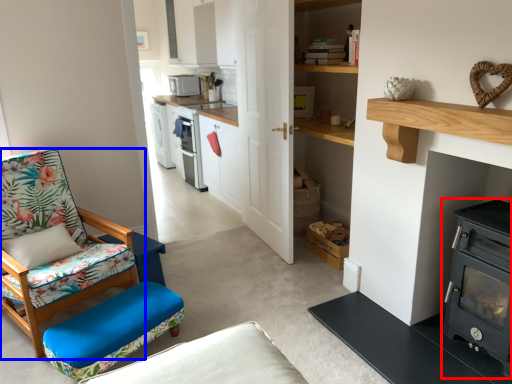
Question: Among these objects, which one is farthest to the camera, wood burning stove (highlighted by a red box) or chair (highlighted by a blue box)?

Choices:
 (A) wood burning stove
 (B) chair

Answer: (B)